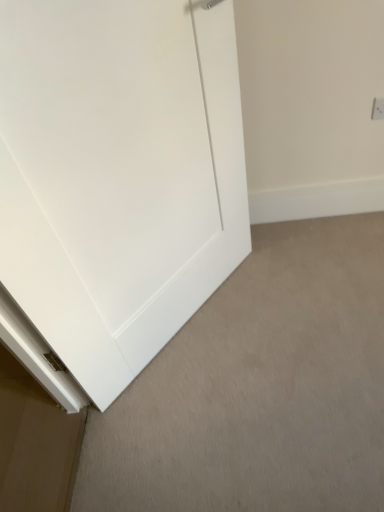
Question: Is white plastic electric outlet at upper right spatially inside white matte door at center, or outside of it?

Choices:
 (A) inside
 (B) outside

Answer: (B)

Question: Based on their sizes in the image, would you say white plastic electric outlet at upper right is bigger or smaller than white matte door at center?

Choices:
 (A) small
 (B) big

Answer: (A)

Question: Based on their relative distances, which object is farther from the white matte baseboard at lower left?

Choices:
 (A) white matte door at center
 (B) white plastic electric outlet at upper right

Answer: (B)

Question: Considering the real-world distances, which object is closest to the white matte baseboard at lower left?

Choices:
 (A) white matte door at center
 (B) white plastic electric outlet at upper right

Answer: (A)